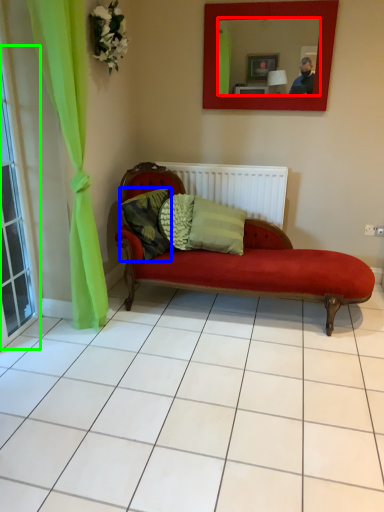
Question: Considering the real-world distances, which object is farthest from mirror (highlighted by a red box)? pillow (highlighted by a blue box) or window (highlighted by a green box)?

Choices:
 (A) pillow
 (B) window

Answer: (B)